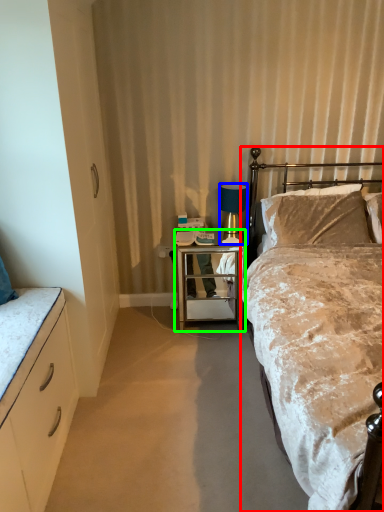
Question: Which object is the closest to the bed (highlighted by a red box)? Choose among these: lamp (highlighted by a blue box) or desk (highlighted by a green box).

Choices:
 (A) lamp
 (B) desk

Answer: (B)